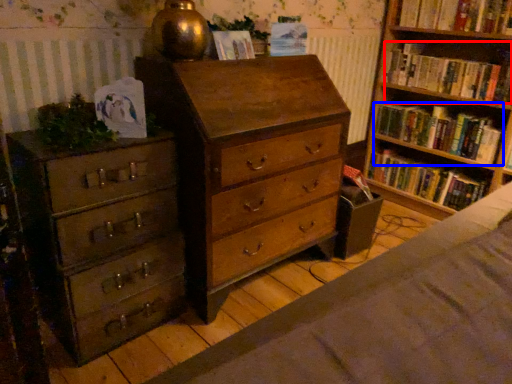
Question: Which point is closer to the camera, book (highlighted by a red box) or book (highlighted by a blue box)?

Choices:
 (A) book
 (B) book

Answer: (A)